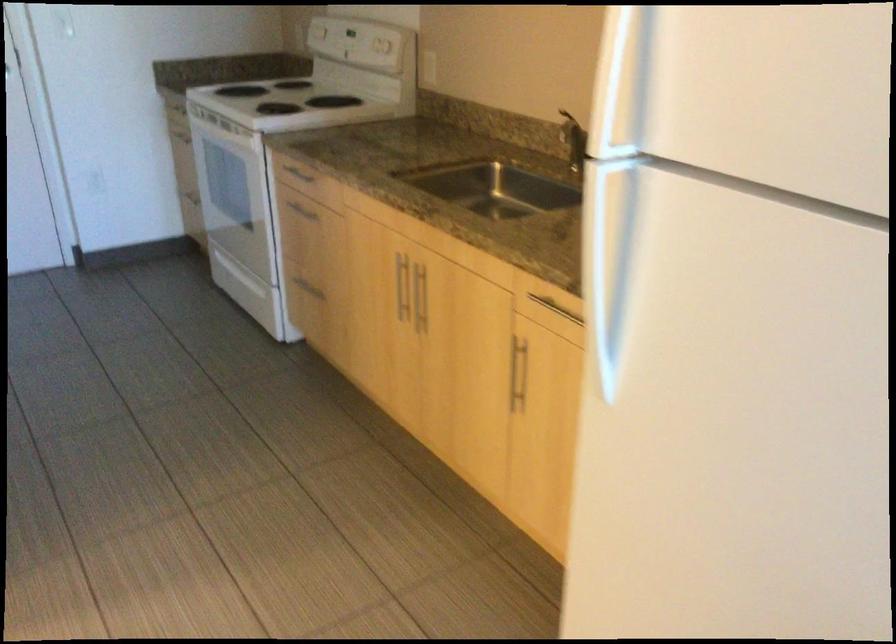
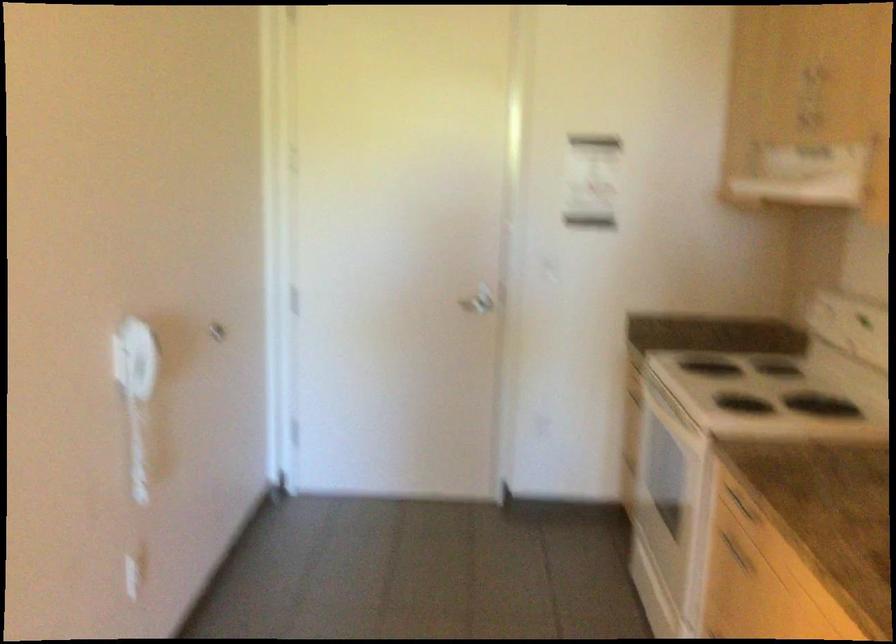
Question: The first image is from the beginning of the video and the second image is from the end. How did the camera likely rotate when shooting the video?

Choices:
 (A) Left
 (B) Right
 (C) Up
 (D) Down

Answer: (A)